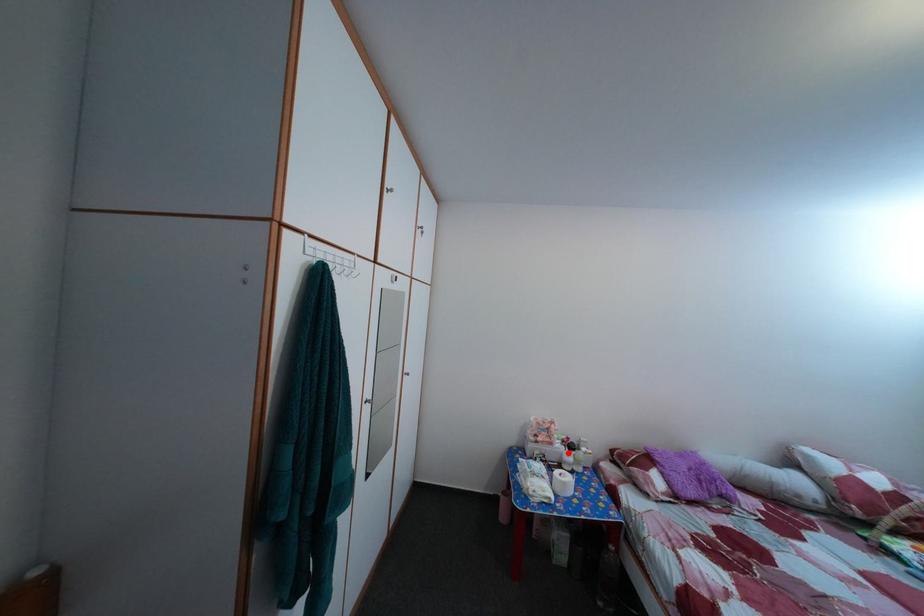
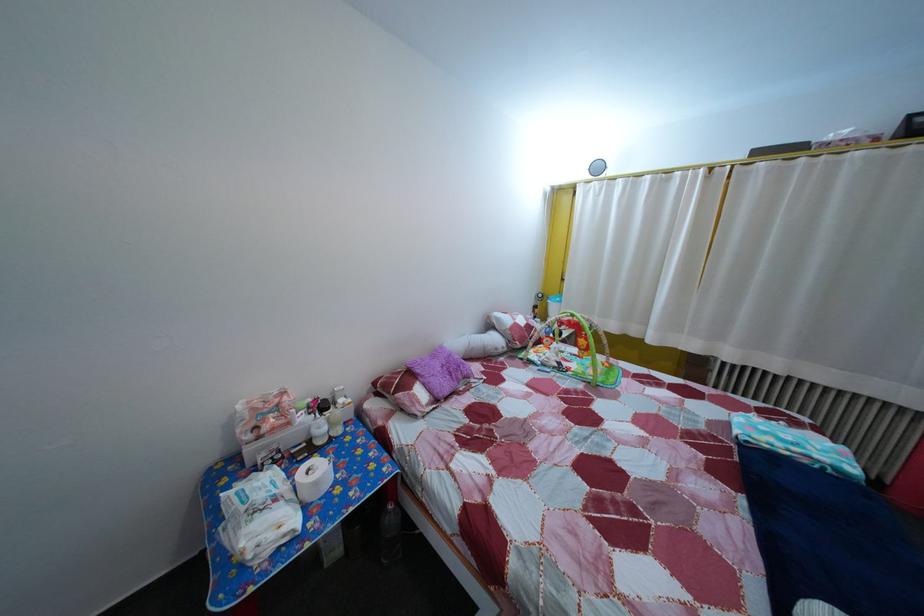
The point at the highlighted location is marked in the first image. Where is the corresponding point in the second image?

(311, 427)